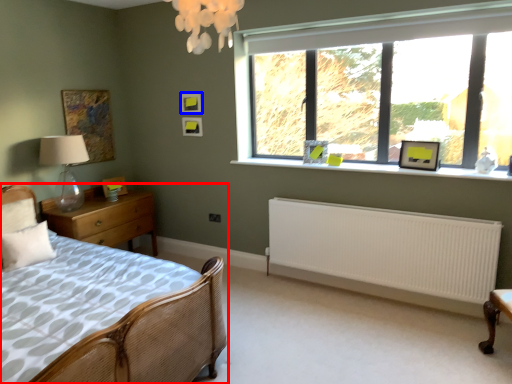
Question: Among these objects, which one is farthest to the camera, bed (highlighted by a red box) or picture frame (highlighted by a blue box)?

Choices:
 (A) bed
 (B) picture frame

Answer: (B)